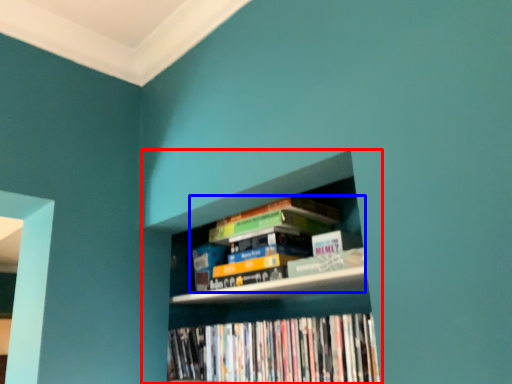
Question: Which object appears farthest to the camera in this image, bookcase (highlighted by a red box) or book (highlighted by a blue box)?

Choices:
 (A) bookcase
 (B) book

Answer: (B)